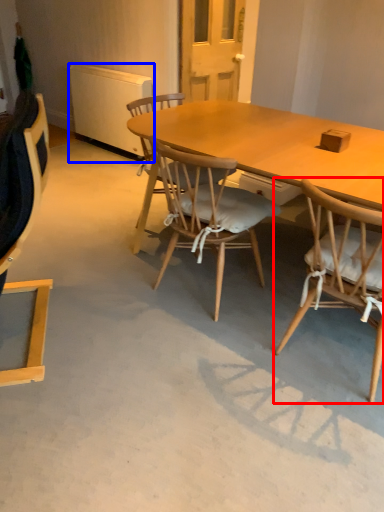
Question: Among these objects, which one is nearest to the camera, chair (highlighted by a red box) or radiator (highlighted by a blue box)?

Choices:
 (A) chair
 (B) radiator

Answer: (A)